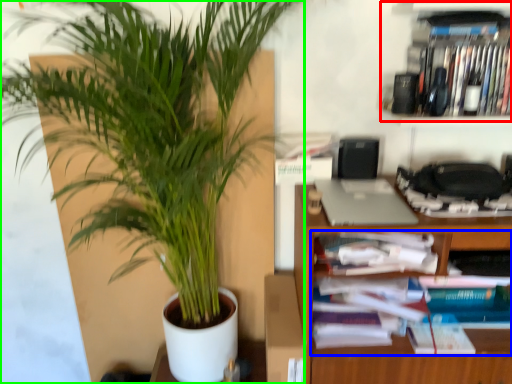
Question: Considering the real-world distances, which object is farthest from cabinet (highlighted by a red box)? book (highlighted by a blue box) or houseplant (highlighted by a green box)?

Choices:
 (A) book
 (B) houseplant

Answer: (B)